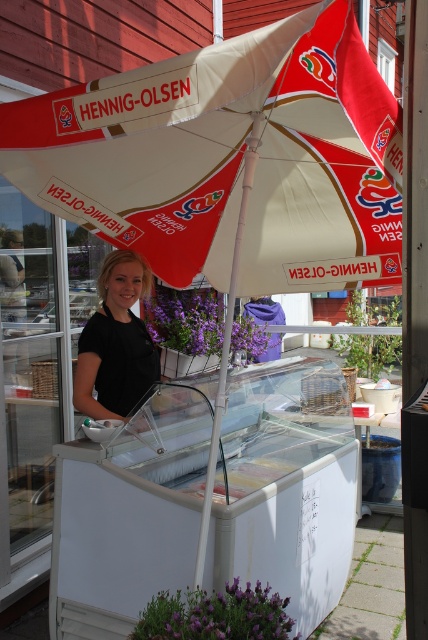
Can you confirm if white fabric umbrella at center is positioned below black matte shirt at center?

No, white fabric umbrella at center is not below black matte shirt at center.

Based on the photo, who is taller, white fabric umbrella at center or black matte shirt at center?

black matte shirt at center

Between point (217, 154) and point (94, 417), which one is positioned in front?

Point (94, 417) is more forward.

This screenshot has width=428, height=640. Find the location of `white fabric umbrella at center`. white fabric umbrella at center is located at coordinates (228, 157).